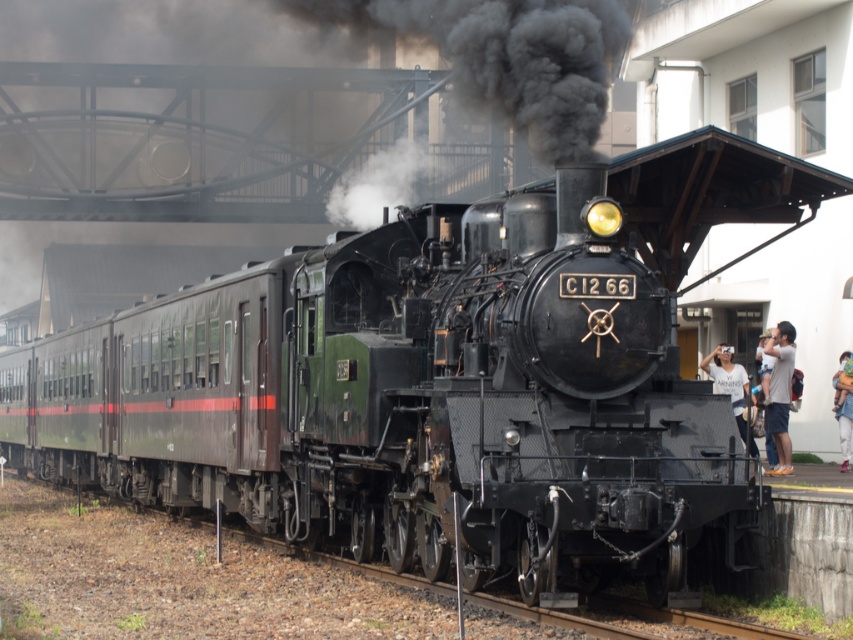
From the picture: Is light skin/white shirt at right thinner than light blue denim jeans at lower right?

Yes, light skin/white shirt at right is thinner than light blue denim jeans at lower right.

Can you confirm if light skin/white shirt at right is wider than light blue denim jeans at lower right?

No.

Which is behind, point (780, 422) or point (839, 426)?

The point (839, 426) is more distant.

Identify the location of light skin/white shirt at right. (779, 394).

Consider the image. Measure the distance between light skin/white shirt at right and white cotton shirt at center.

A distance of 1.08 meters exists between light skin/white shirt at right and white cotton shirt at center.

Which of these two, light skin/white shirt at right or white cotton shirt at center, stands shorter?

Standing shorter between the two is white cotton shirt at center.

Based on the photo, who is more distant from viewer, (x=776, y=448) or (x=730, y=385)?

The point (x=776, y=448) is more distant.

This screenshot has width=853, height=640. I want to click on light skin/white shirt at right, so [779, 394].

Which of these two, white cotton shirt at center or light blue denim jeans at lower right, stands shorter?

Standing shorter between the two is white cotton shirt at center.

What do you see at coordinates (730, 387) in the screenshot? I see `white cotton shirt at center` at bounding box center [730, 387].

Describe the element at coordinates (730, 387) in the screenshot. I see `white cotton shirt at center` at that location.

Image resolution: width=853 pixels, height=640 pixels. What are the coordinates of `white cotton shirt at center` in the screenshot? It's located at (730, 387).